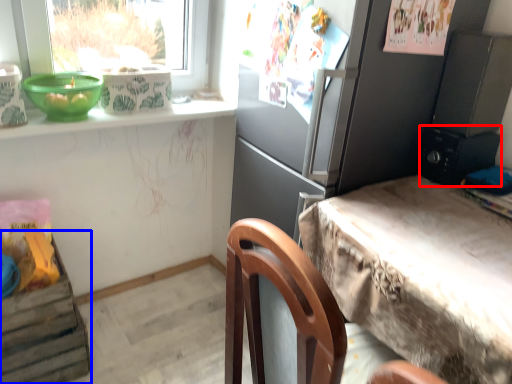
Question: Which point is closer to the camera, appliance (highlighted by a red box) or shelf (highlighted by a blue box)?

Choices:
 (A) appliance
 (B) shelf

Answer: (B)